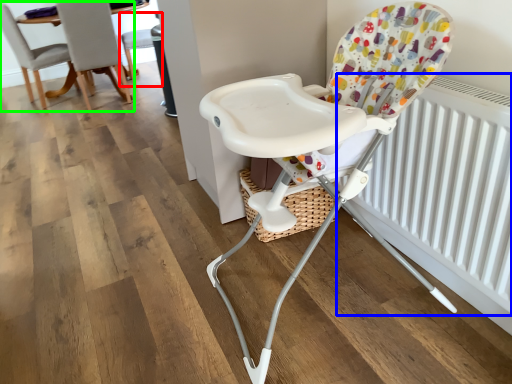
Question: Which object is the farthest from chair (highlighted by a red box)? Choose among these: radiator (highlighted by a blue box) or chair (highlighted by a green box).

Choices:
 (A) radiator
 (B) chair

Answer: (A)